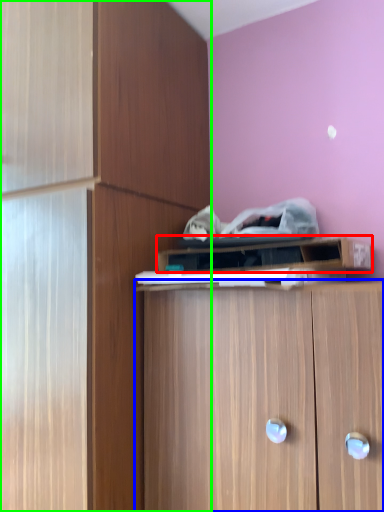
Question: Which object is positioned farthest from cabinetry (highlighted by a red box)? Select from cabinetry (highlighted by a blue box) and cabinetry (highlighted by a green box).

Choices:
 (A) cabinetry
 (B) cabinetry

Answer: (B)